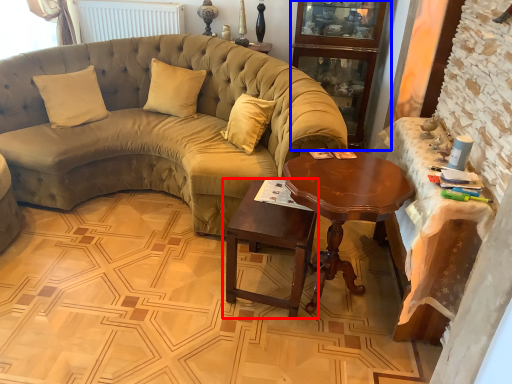
Question: Among these objects, which one is nearest to the camera, table (highlighted by a red box) or bookshelf (highlighted by a blue box)?

Choices:
 (A) table
 (B) bookshelf

Answer: (A)